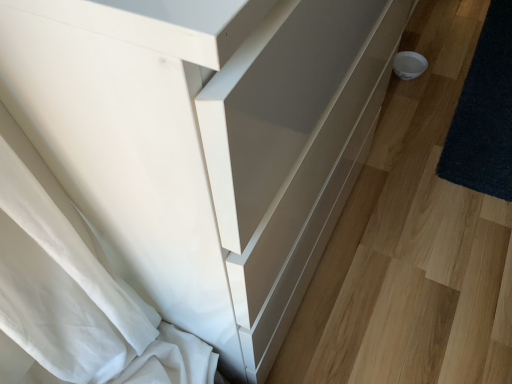
The width and height of the screenshot is (512, 384). Describe the element at coordinates (484, 113) in the screenshot. I see `dark blue shaggy rug at lower right` at that location.

Image resolution: width=512 pixels, height=384 pixels. I want to click on dark blue shaggy rug at lower right, so click(484, 113).

Identify the location of white glossy drawer at lower right. The width and height of the screenshot is (512, 384). (313, 181).

Describe the element at coordinates (313, 181) in the screenshot. The image size is (512, 384). I see `white glossy drawer at lower right` at that location.

Locate an element on the screen. The width and height of the screenshot is (512, 384). dark blue shaggy rug at lower right is located at coordinates (484, 113).

Which object is positioned more to the right, white glossy drawer at lower right or dark blue shaggy rug at lower right?

dark blue shaggy rug at lower right.

Is white glossy drawer at lower right closer to the viewer compared to dark blue shaggy rug at lower right?

Yes.

Does point (271, 275) lie behind point (506, 193)?

No, it is in front of (506, 193).

From the image's perspective, is white glossy drawer at lower right above dark blue shaggy rug at lower right?

No, from the image's perspective, white glossy drawer at lower right is not over dark blue shaggy rug at lower right.

From a real-world perspective, which is physically above, white glossy drawer at lower right or dark blue shaggy rug at lower right?

white glossy drawer at lower right is physically above.

Considering the sizes of objects white glossy drawer at lower right and dark blue shaggy rug at lower right in the image provided, who is wider, white glossy drawer at lower right or dark blue shaggy rug at lower right?

white glossy drawer at lower right is wider.

Can you confirm if white glossy drawer at lower right is taller than dark blue shaggy rug at lower right?

No.

Considering the relative sizes of white glossy drawer at lower right and dark blue shaggy rug at lower right in the image provided, is white glossy drawer at lower right bigger than dark blue shaggy rug at lower right?

Correct, white glossy drawer at lower right is larger in size than dark blue shaggy rug at lower right.

Is white glossy drawer at lower right completely or partially outside of dark blue shaggy rug at lower right?

white glossy drawer at lower right lies outside dark blue shaggy rug at lower right's area.

Is white glossy drawer at lower right not near dark blue shaggy rug at lower right?

No, white glossy drawer at lower right is not far from dark blue shaggy rug at lower right.

Is white glossy drawer at lower right facing towards dark blue shaggy rug at lower right?

Yes, white glossy drawer at lower right is facing dark blue shaggy rug at lower right.

In the scene shown: How much distance is there between white glossy drawer at lower right and dark blue shaggy rug at lower right?

The distance of white glossy drawer at lower right from dark blue shaggy rug at lower right is 29.62 inches.

You are a GUI agent. You are given a task and a screenshot of the screen. Output one action in this format:
    pyautogui.click(x=<x>, y=<y>)
    Task: Click on the mat on the right of white glossy drawer at lower right
    Image resolution: width=512 pixels, height=384 pixels.
    Given the screenshot: What is the action you would take?
    pyautogui.click(x=484, y=113)

Between dark blue shaggy rug at lower right and white glossy drawer at lower right, which one appears on the left side from the viewer's perspective?

white glossy drawer at lower right is more to the left.

In the image, is dark blue shaggy rug at lower right positioned in front of or behind white glossy drawer at lower right?

Visually, dark blue shaggy rug at lower right is located behind white glossy drawer at lower right.

Does point (482, 102) come closer to viewer compared to point (258, 262)?

No, it is behind (258, 262).

From the image's perspective, is dark blue shaggy rug at lower right above white glossy drawer at lower right?

Yes, from the image's perspective, dark blue shaggy rug at lower right is above white glossy drawer at lower right.

From a real-world perspective, is dark blue shaggy rug at lower right above or below white glossy drawer at lower right?

Clearly, from a real-world perspective, dark blue shaggy rug at lower right is below white glossy drawer at lower right.

Is dark blue shaggy rug at lower right thinner than white glossy drawer at lower right?

Yes, dark blue shaggy rug at lower right is thinner than white glossy drawer at lower right.

Can you confirm if dark blue shaggy rug at lower right is taller than white glossy drawer at lower right?

Yes, dark blue shaggy rug at lower right is taller than white glossy drawer at lower right.

Who is bigger, dark blue shaggy rug at lower right or white glossy drawer at lower right?

Bigger between the two is white glossy drawer at lower right.

Is dark blue shaggy rug at lower right inside or outside of white glossy drawer at lower right?

dark blue shaggy rug at lower right is inside white glossy drawer at lower right.

Is dark blue shaggy rug at lower right directly adjacent to white glossy drawer at lower right?

No, dark blue shaggy rug at lower right is not with white glossy drawer at lower right.

Does dark blue shaggy rug at lower right turn towards white glossy drawer at lower right?

Yes, dark blue shaggy rug at lower right is aimed at white glossy drawer at lower right.

Where is `drawer that is above the dark blue shaggy rug at lower right (from a real-world perspective)`? The image size is (512, 384). drawer that is above the dark blue shaggy rug at lower right (from a real-world perspective) is located at coordinates (313, 181).

Locate an element on the screen. The height and width of the screenshot is (384, 512). drawer that is above the dark blue shaggy rug at lower right (from a real-world perspective) is located at coordinates (313, 181).

Identify the location of drawer below the dark blue shaggy rug at lower right (from the image's perspective). (313, 181).